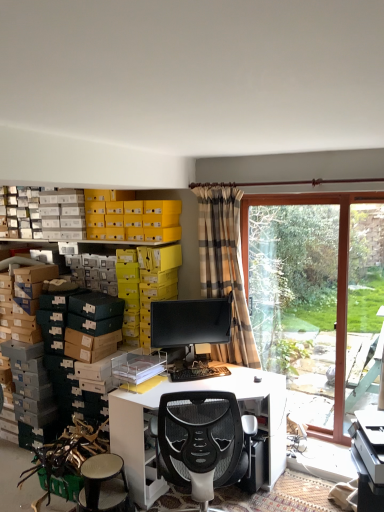
What is the approximate height of plaid fabric curtain at center?

The height of plaid fabric curtain at center is 5.11 feet.

This screenshot has height=512, width=384. In order to click on white glossy desk at center in this screenshot , I will do `click(194, 390)`.

What do you see at coordinates (337, 277) in the screenshot? I see `transparent glass window at right` at bounding box center [337, 277].

The image size is (384, 512). What do you see at coordinates (190, 322) in the screenshot?
I see `matte black monitor at center` at bounding box center [190, 322].

The height and width of the screenshot is (512, 384). What are the coordinates of `plaid fabric curtain at center` in the screenshot? It's located at (225, 268).

From the picture: Considering the relative sizes of transparent glass window at right and matte black monitor at center in the image provided, is transparent glass window at right wider than matte black monitor at center?

Yes, transparent glass window at right is wider than matte black monitor at center.

From a real-world perspective, is transparent glass window at right below matte black monitor at center?

Incorrect, from a real-world perspective, transparent glass window at right is higher than matte black monitor at center.

Is point (246, 201) more distant than point (168, 346)?

No.

Does transparent glass window at right lie behind matte black monitor at center?

No.

Locate an element on the screen. The height and width of the screenshot is (512, 384). desk directly beneath the plaid fabric curtain at center (from a real-world perspective) is located at coordinates point(194,390).

Is plaid fabric curtain at center surrounded by white glossy desk at center?

No, plaid fabric curtain at center is not surrounded by white glossy desk at center.

Which is farther, (156, 484) or (221, 283)?

Positioned behind is point (221, 283).

In the scene shown: Does white glossy desk at center lie behind plaid fabric curtain at center?

No.

From the picture: Are matte black monitor at center and white glossy desk at center making contact?

No, matte black monitor at center is not with white glossy desk at center.

Is point (202, 303) closer or farther from the camera than point (153, 405)?

Point (202, 303) is farther from the camera than point (153, 405).

From the picture: Is matte black monitor at center positioned before white glossy desk at center?

No, it is not.

Between matte black monitor at center and white glossy desk at center, which one has smaller size?

matte black monitor at center is smaller.

Is transparent glass window at right surrounding white textured stool at lower left?

No, transparent glass window at right does not contain white textured stool at lower left.

Based on their positions, is transparent glass window at right located to the left or right of white textured stool at lower left?

In the image, transparent glass window at right appears on the right side of white textured stool at lower left.

In order to click on stool in front of the transparent glass window at right in this screenshot , I will do `click(104, 484)`.

Considering the sizes of transparent glass window at right and white textured stool at lower left in the image, is transparent glass window at right wider or thinner than white textured stool at lower left?

Clearly, transparent glass window at right has less width compared to white textured stool at lower left.

Is white glossy desk at center surrounding matte black monitor at center?

No, matte black monitor at center is located outside of white glossy desk at center.

How far apart are white glossy desk at center and matte black monitor at center?

21.11 inches.

Does point (263, 388) come in front of point (157, 313)?

Yes, point (263, 388) is closer to viewer.

Considering the sizes of white glossy desk at center and matte black monitor at center in the image, is white glossy desk at center taller or shorter than matte black monitor at center?

white glossy desk at center is taller than matte black monitor at center.

Which of these two, black plastic keyboard at center or matte black monitor at center, is wider?

With larger width is black plastic keyboard at center.

From the picture: Which is behind, black plastic keyboard at center or matte black monitor at center?

Positioned behind is matte black monitor at center.

Is black plastic keyboard at center touching matte black monitor at center?

black plastic keyboard at center and matte black monitor at center are clearly separated.

Is black plastic keyboard at center oriented towards matte black monitor at center?

No, black plastic keyboard at center is not turned towards matte black monitor at center.

Considering the sizes of white textured stool at lower left and transparent glass window at right in the image, is white textured stool at lower left wider or thinner than transparent glass window at right?

Clearly, white textured stool at lower left has more width compared to transparent glass window at right.

Would you consider white textured stool at lower left to be distant from transparent glass window at right?

Indeed, white textured stool at lower left is not near transparent glass window at right.

Is white textured stool at lower left looking in the opposite direction of transparent glass window at right?

No, white textured stool at lower left is not facing the opposite direction of transparent glass window at right.

Locate an element on the screen. Image resolution: width=384 pixels, height=512 pixels. bay window above the white textured stool at lower left (from the image's perspective) is located at coordinates (337, 277).

Image resolution: width=384 pixels, height=512 pixels. I want to click on bay window above the matte black monitor at center (from a real-world perspective), so click(x=337, y=277).

This screenshot has height=512, width=384. I want to click on desk in front of the plaid fabric curtain at center, so click(194, 390).

Based on their spatial positions, is white glossy desk at center or plaid fabric curtain at center closer to white textured stool at lower left?

white glossy desk at center.

In the scene shown: Considering their positions, is black plastic keyboard at center positioned closer to plaid fabric curtain at center than white textured stool at lower left?

black plastic keyboard at center is positioned closer to the anchor plaid fabric curtain at center.

From the image, which object appears to be nearer to white glossy desk at center, transparent glass window at right or plaid fabric curtain at center?

plaid fabric curtain at center is positioned closer to the anchor white glossy desk at center.

Which object lies further to the anchor point white textured stool at lower left, transparent glass window at right or black plastic keyboard at center?

Among the two, transparent glass window at right is located further to white textured stool at lower left.

Considering their positions, is plaid fabric curtain at center positioned closer to transparent glass window at right than white glossy desk at center?

Based on the image, white glossy desk at center appears to be nearer to transparent glass window at right.

Estimate the real-world distances between objects in this image. Which object is further from transparent glass window at right, white textured stool at lower left or matte black monitor at center?

white textured stool at lower left lies further to transparent glass window at right than the other object.

Estimate the real-world distances between objects in this image. Which object is further from white glossy desk at center, transparent glass window at right or white textured stool at lower left?

transparent glass window at right is further to white glossy desk at center.

Based on their spatial positions, is black plastic keyboard at center or plaid fabric curtain at center closer to matte black monitor at center?

plaid fabric curtain at center is closer to matte black monitor at center.

This screenshot has width=384, height=512. I want to click on stool positioned between white glossy desk at center and black plastic keyboard at center from near to far, so click(x=104, y=484).

This screenshot has height=512, width=384. In order to click on computer keyboard between white glossy desk at center and matte black monitor at center from front to back in this screenshot , I will do point(198,373).

This screenshot has height=512, width=384. What are the coordinates of `computer keyboard between plaid fabric curtain at center and white glossy desk at center in the up-down direction` in the screenshot? It's located at (198, 373).

Find the location of a particular element. The width and height of the screenshot is (384, 512). computer keyboard between white textured stool at lower left and transparent glass window at right from left to right is located at coordinates (198, 373).